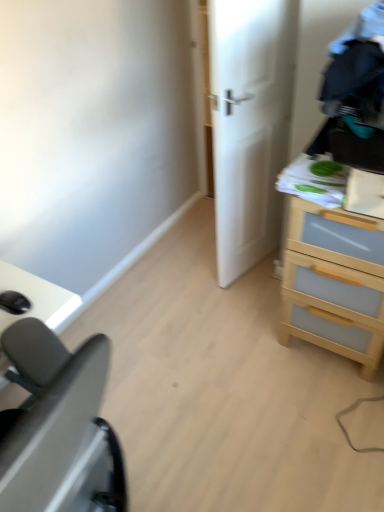
Question: From a real-world perspective, is black matte desk at lower left over white matte door at center?

Choices:
 (A) no
 (B) yes

Answer: (A)

Question: From the image's perspective, is black matte desk at lower left located beneath white matte door at center?

Choices:
 (A) no
 (B) yes

Answer: (B)

Question: Considering the relative positions of black matte desk at lower left and white matte door at center in the image provided, is black matte desk at lower left behind white matte door at center?

Choices:
 (A) no
 (B) yes

Answer: (A)

Question: Is black matte desk at lower left oriented towards white matte door at center?

Choices:
 (A) yes
 (B) no

Answer: (B)

Question: Is black matte desk at lower left oriented away from white matte door at center?

Choices:
 (A) yes
 (B) no

Answer: (B)

Question: Does black matte desk at lower left appear on the left side of white matte door at center?

Choices:
 (A) no
 (B) yes

Answer: (B)

Question: Does white matte door at center come in front of light wood chest of drawers at right?

Choices:
 (A) yes
 (B) no

Answer: (B)

Question: Is white matte door at center positioned with its back to light wood chest of drawers at right?

Choices:
 (A) no
 (B) yes

Answer: (B)

Question: Does white matte door at center have a greater width compared to light wood chest of drawers at right?

Choices:
 (A) no
 (B) yes

Answer: (A)

Question: Does white matte door at center touch light wood chest of drawers at right?

Choices:
 (A) no
 (B) yes

Answer: (A)

Question: Is white matte door at center positioned behind light wood chest of drawers at right?

Choices:
 (A) yes
 (B) no

Answer: (A)

Question: Is white matte door at center at the left side of light wood chest of drawers at right?

Choices:
 (A) no
 (B) yes

Answer: (B)

Question: Considering the relative sizes of black matte desk at lower left and light wood chest of drawers at right in the image provided, is black matte desk at lower left thinner than light wood chest of drawers at right?

Choices:
 (A) no
 (B) yes

Answer: (A)